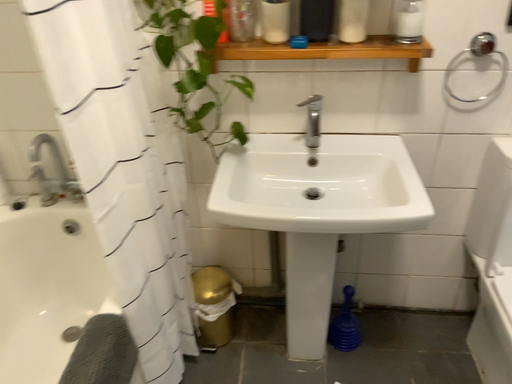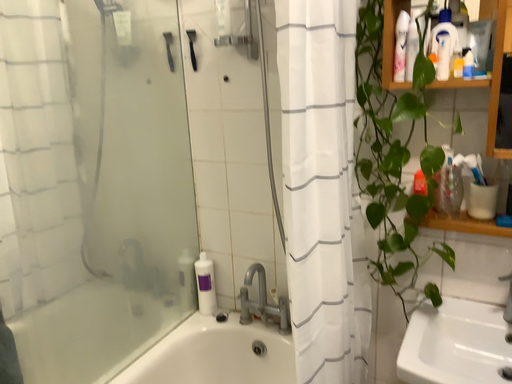
Question: Which way did the camera rotate in the video?

Choices:
 (A) rotated downward
 (B) rotated upward

Answer: (B)